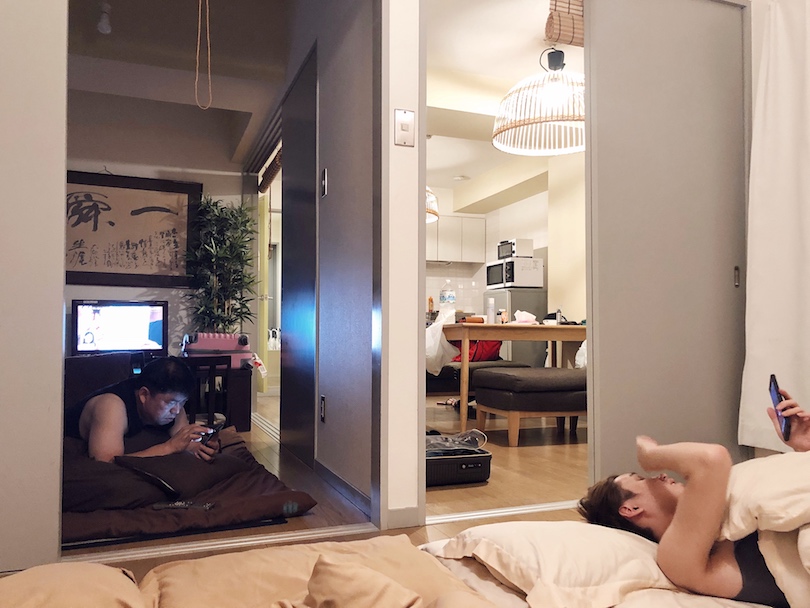
What are the coordinates of `table` in the screenshot? It's located at (484, 334).